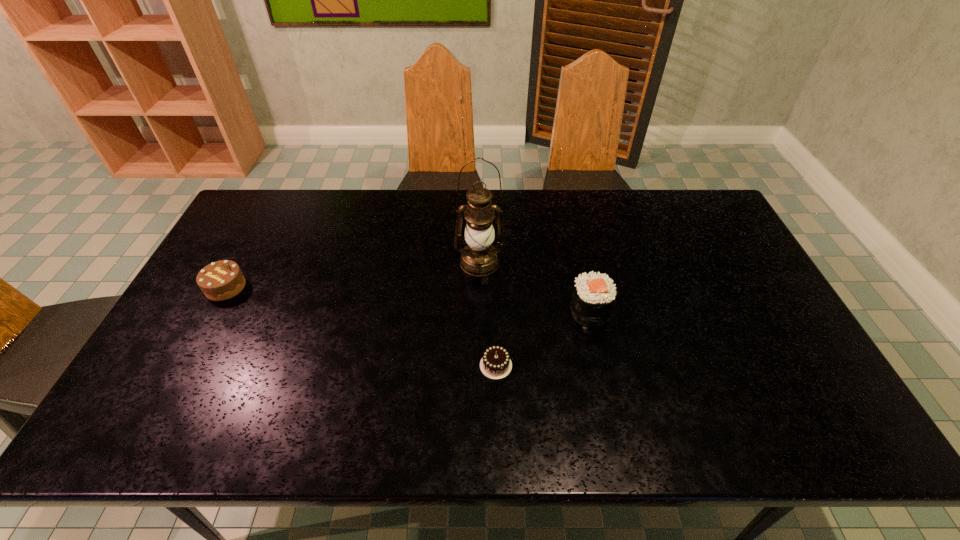
The image size is (960, 540). Identify the location of free space that satisfies the following two spatial constraints: 1. on the front side of the farther chocolate cake; 2. on the left side of the nearest object. (183, 366).

Find the location of a particular element. vacant space that satisfies the following two spatial constraints: 1. on the back side of the taller chocolate cake; 2. on the left side of the oil lamp is located at coordinates (239, 262).